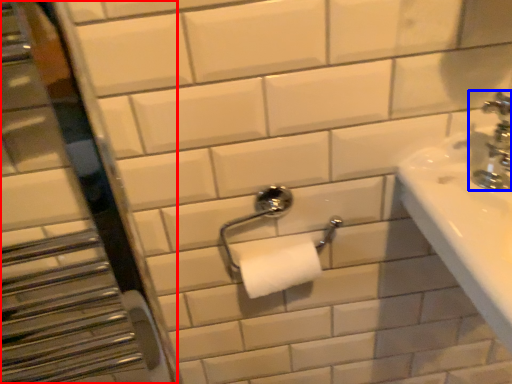
Question: Which of the following is the farthest to the observer, mirror (highlighted by a red box) or tap (highlighted by a blue box)?

Choices:
 (A) mirror
 (B) tap

Answer: (B)